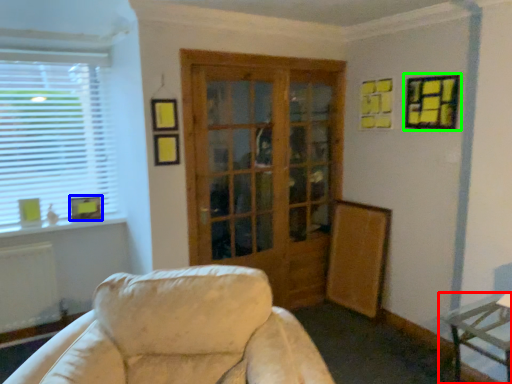
Question: Which is nearer to the table (highlighted by a red box)? picture frame (highlighted by a blue box) or picture frame (highlighted by a green box).

Choices:
 (A) picture frame
 (B) picture frame

Answer: (B)